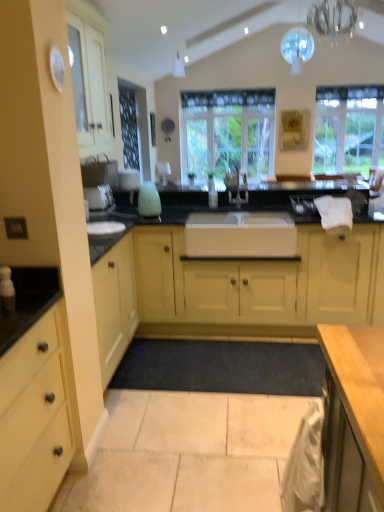
Question: Is matte yellow cabinets at center, which appears as the first cabinetry when viewed from the back, completely or partially inside clear glass chandelier at upper center, which ranks as the second light fixture in top-to-bottom order?

Choices:
 (A) no
 (B) yes

Answer: (A)

Question: Considering the relative sizes of clear glass chandelier at upper center, acting as the 1th light fixture starting from the bottom, and matte yellow cabinets at center, acting as the second cabinetry starting from the front, in the image provided, is clear glass chandelier at upper center, acting as the 1th light fixture starting from the bottom, wider than matte yellow cabinets at center, acting as the second cabinetry starting from the front,?

Choices:
 (A) yes
 (B) no

Answer: (B)

Question: From a real-world perspective, is clear glass chandelier at upper center, acting as the 1th light fixture starting from the bottom, on matte yellow cabinets at center, acting as the second cabinetry starting from the front?

Choices:
 (A) yes
 (B) no

Answer: (A)

Question: Is clear glass chandelier at upper center, acting as the 1th light fixture starting from the bottom, facing away from matte yellow cabinets at center, which appears as the first cabinetry when viewed from the back?

Choices:
 (A) yes
 (B) no

Answer: (B)

Question: Is clear glass chandelier at upper center, which ranks as the second light fixture in top-to-bottom order, located outside matte yellow cabinets at center, which appears as the first cabinetry when viewed from the back?

Choices:
 (A) no
 (B) yes

Answer: (B)

Question: Visually, is dark gray carpet at center positioned to the left or to the right of white glossy faucet at center?

Choices:
 (A) right
 (B) left

Answer: (B)

Question: Relative to white glossy faucet at center, is dark gray carpet at center in front or behind?

Choices:
 (A) front
 (B) behind

Answer: (A)

Question: From the image's perspective, is dark gray carpet at center positioned above or below white glossy faucet at center?

Choices:
 (A) below
 (B) above

Answer: (A)

Question: In terms of width, does dark gray carpet at center look wider or thinner when compared to white glossy faucet at center?

Choices:
 (A) thin
 (B) wide

Answer: (B)

Question: From the image's perspective, is matte yellow cabinets at center, which appears as the first cabinetry when viewed from the back, above or below transparent glass sphere at upper center, the 2th light fixture positioned from the bottom?

Choices:
 (A) below
 (B) above

Answer: (A)

Question: Would you say matte yellow cabinets at center, acting as the second cabinetry starting from the front, is inside or outside transparent glass sphere at upper center, positioned as the second light fixture in front-to-back order?

Choices:
 (A) outside
 (B) inside

Answer: (A)

Question: Considering the positions of matte yellow cabinets at center, which appears as the first cabinetry when viewed from the back, and transparent glass sphere at upper center, acting as the 1th light fixture starting from the back, in the image, is matte yellow cabinets at center, which appears as the first cabinetry when viewed from the back, bigger or smaller than transparent glass sphere at upper center, acting as the 1th light fixture starting from the back,?

Choices:
 (A) small
 (B) big

Answer: (B)

Question: Relative to transparent glass sphere at upper center, the 2th light fixture positioned from the bottom, is matte yellow cabinets at center, which appears as the first cabinetry when viewed from the back, in front or behind?

Choices:
 (A) front
 (B) behind

Answer: (A)

Question: Considering their positions, is clear glass chandelier at upper center, marked as the 1th light fixture in a front-to-back arrangement, located in front of or behind matte yellow cabinet at left, the second cabinetry in the back-to-front sequence?

Choices:
 (A) front
 (B) behind

Answer: (B)

Question: Do you think clear glass chandelier at upper center, the 2th light fixture viewed from the back, is within matte yellow cabinet at left, the second cabinetry in the back-to-front sequence, or outside of it?

Choices:
 (A) outside
 (B) inside

Answer: (A)